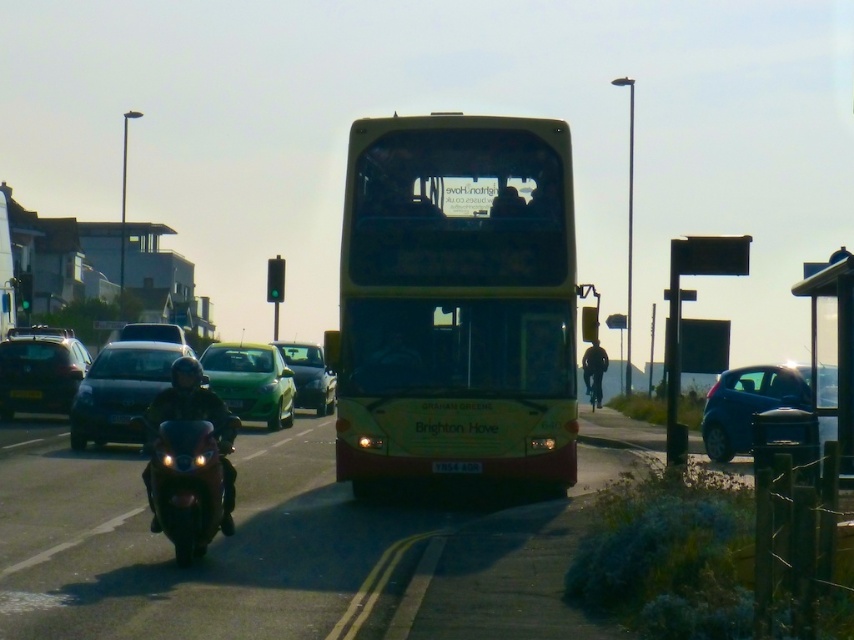
Question: Which of these objects is positioned closest to the shiny black motorcycle at left?

Choices:
 (A) metallic silver bus stop at right
 (B) matte black car at left

Answer: (A)

Question: Which object is the farthest from the metallic sign at right?

Choices:
 (A) metallic silver bus stop at right
 (B) matte black car at left
 (C) yellow matte license plate at center

Answer: (B)

Question: Is green matte car at center wider than metallic sign at right?

Choices:
 (A) yes
 (B) no

Answer: (B)

Question: Does shiny black motorcycle at left appear over white plastic license plate at center?

Choices:
 (A) no
 (B) yes

Answer: (B)

Question: Is metallic sign at right positioned behind shiny black motorcycle at left?

Choices:
 (A) yes
 (B) no

Answer: (A)

Question: Among these points, which one is farthest from the camera?

Choices:
 (A) (273, 412)
 (B) (34, 397)
 (C) (155, 508)

Answer: (A)